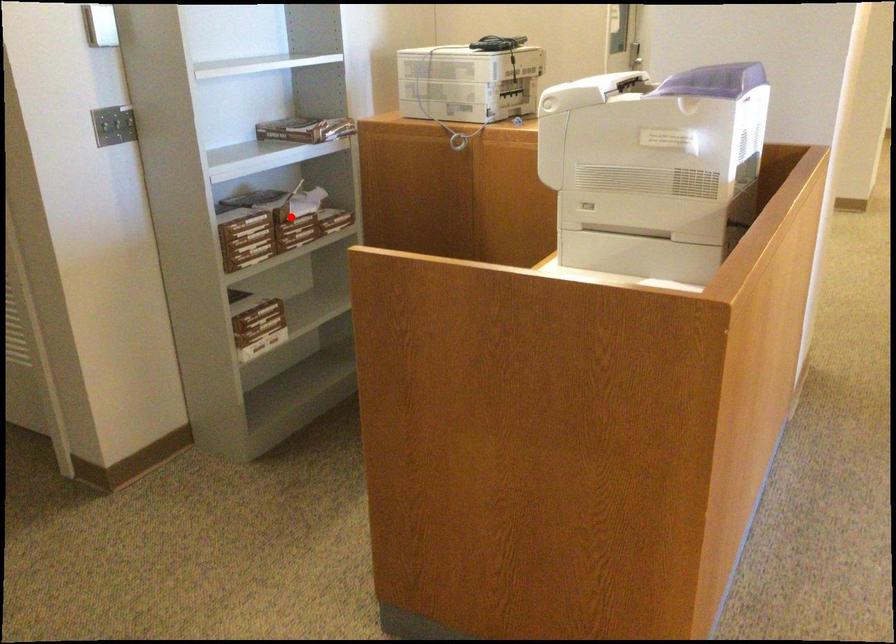
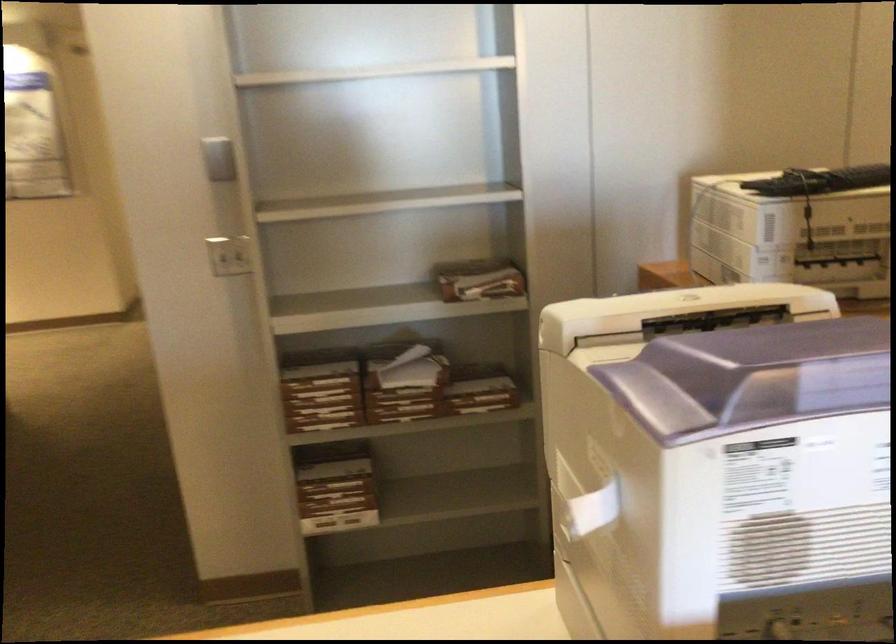
Question: I am providing you with two images of the same scene from different viewpoints. A red point is shown in image1. For the corresponding object point in image2, is it positioned nearer or farther from the camera?

Choices:
 (A) Nearer
 (B) Farther

Answer: (A)